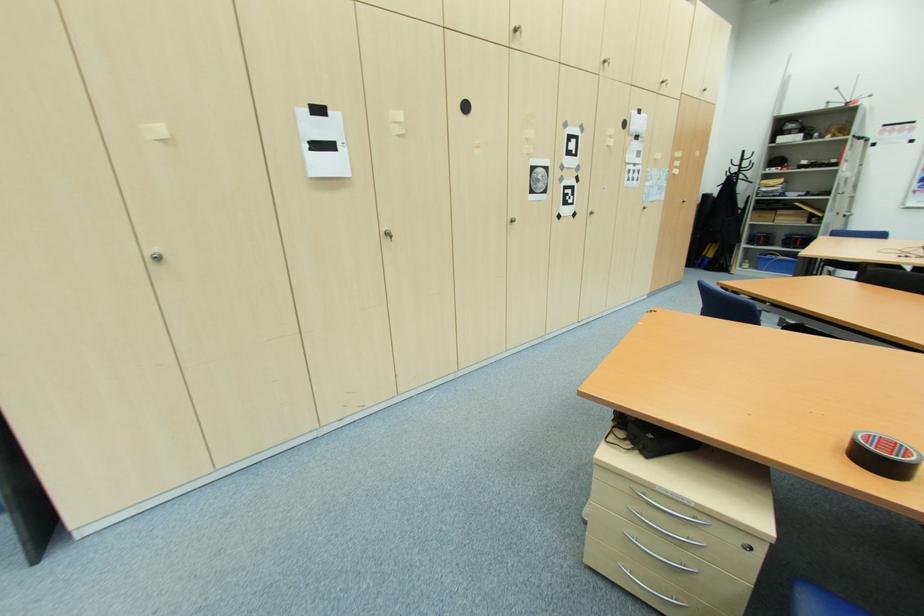
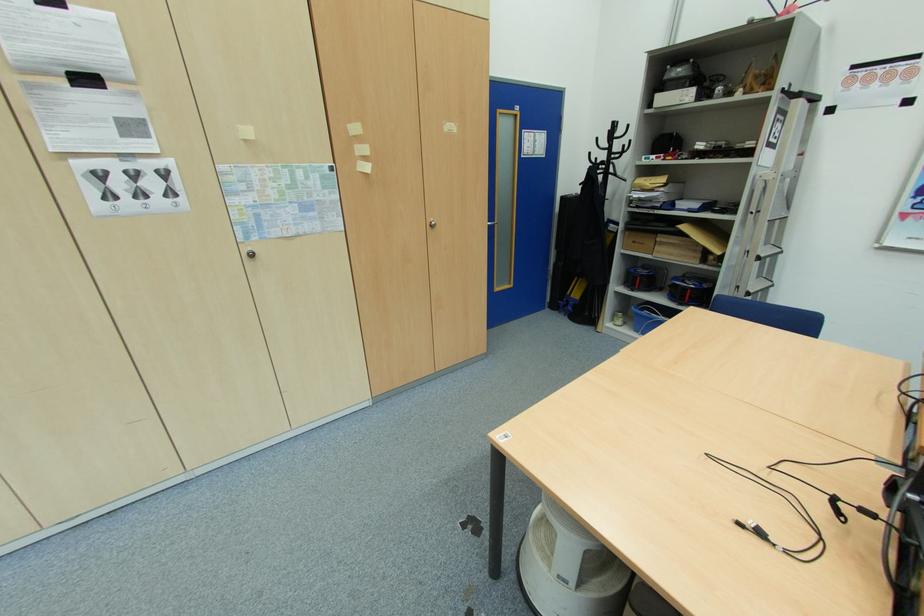
The point at [781,209] is marked in the first image. Where is the corresponding point in the second image?

(660, 233)